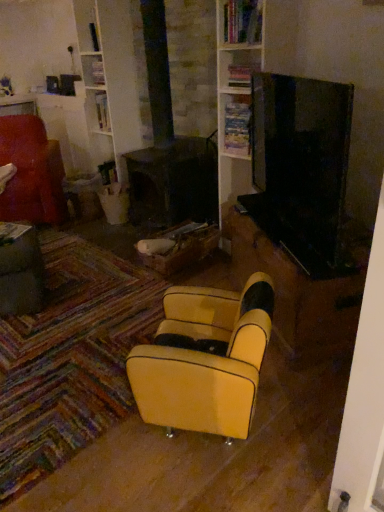
Question: Considering the relative positions of wooden bookshelf at upper center, positioned as the second shelf in top-to-bottom order, and velvet red armchair at left, the 2th chair in the front-to-back sequence, in the image provided, is wooden bookshelf at upper center, positioned as the second shelf in top-to-bottom order, to the left of velvet red armchair at left, the 2th chair in the front-to-back sequence, from the viewer's perspective?

Choices:
 (A) yes
 (B) no

Answer: (B)

Question: Is the depth of wooden bookshelf at upper center, which appears as the 1th shelf when ordered from the bottom, less than that of velvet red armchair at left, placed as the first chair when sorted from top to bottom?

Choices:
 (A) yes
 (B) no

Answer: (A)

Question: Is wooden bookshelf at upper center, positioned as the second shelf in top-to-bottom order, to the right of velvet red armchair at left, which ranks as the 1th chair in back-to-front order, from the viewer's perspective?

Choices:
 (A) no
 (B) yes

Answer: (B)

Question: Considering the relative sizes of wooden bookshelf at upper center, positioned as the second shelf in top-to-bottom order, and velvet red armchair at left, which ranks as the 1th chair in back-to-front order, in the image provided, is wooden bookshelf at upper center, positioned as the second shelf in top-to-bottom order, taller than velvet red armchair at left, which ranks as the 1th chair in back-to-front order,?

Choices:
 (A) yes
 (B) no

Answer: (B)

Question: Is wooden bookshelf at upper center, positioned as the second shelf in top-to-bottom order, oriented away from velvet red armchair at left, the 2th chair positioned from the bottom?

Choices:
 (A) no
 (B) yes

Answer: (A)

Question: Do you think yellow leather chair at center, which appears as the 2th chair when viewed from the back, is within metallic gray table at lower left, or outside of it?

Choices:
 (A) inside
 (B) outside

Answer: (B)

Question: Visually, is yellow leather chair at center, which is counted as the first chair, starting from the right, positioned to the left or to the right of metallic gray table at lower left?

Choices:
 (A) right
 (B) left

Answer: (A)

Question: From the image's perspective, is yellow leather chair at center, which appears as the 2th chair when viewed from the back, above or below metallic gray table at lower left?

Choices:
 (A) above
 (B) below

Answer: (B)

Question: From a real-world perspective, is yellow leather chair at center, the 1th chair ordered from the bottom, positioned above or below metallic gray table at lower left?

Choices:
 (A) below
 (B) above

Answer: (B)

Question: Is velvet red armchair at left, which ranks as the 1th chair in back-to-front order, in front of or behind wooden bookshelf at upper center, which is the 2th shelf in bottom-to-top order, in the image?

Choices:
 (A) behind
 (B) front

Answer: (A)

Question: Is velvet red armchair at left, which is the second chair in right-to-left order, situated inside wooden bookshelf at upper center, which is the first shelf from top to bottom, or outside?

Choices:
 (A) inside
 (B) outside

Answer: (B)

Question: Looking at the image, does velvet red armchair at left, which is the second chair in right-to-left order, seem bigger or smaller compared to wooden bookshelf at upper center, which is the first shelf from top to bottom?

Choices:
 (A) big
 (B) small

Answer: (A)

Question: Would you say velvet red armchair at left, placed as the first chair when sorted from top to bottom, is to the left or to the right of wooden bookshelf at upper center, which is the 2th shelf in bottom-to-top order, in the picture?

Choices:
 (A) left
 (B) right

Answer: (A)

Question: In terms of height, does wooden bookshelf at upper center, which is the first shelf from top to bottom, look taller or shorter compared to yellow leather chair at center, which appears as the 2th chair when viewed from the back?

Choices:
 (A) tall
 (B) short

Answer: (B)

Question: Considering the positions of wooden bookshelf at upper center, which is the first shelf from top to bottom, and yellow leather chair at center, the 1th chair ordered from the bottom, in the image, is wooden bookshelf at upper center, which is the first shelf from top to bottom, wider or thinner than yellow leather chair at center, the 1th chair ordered from the bottom,?

Choices:
 (A) thin
 (B) wide

Answer: (A)